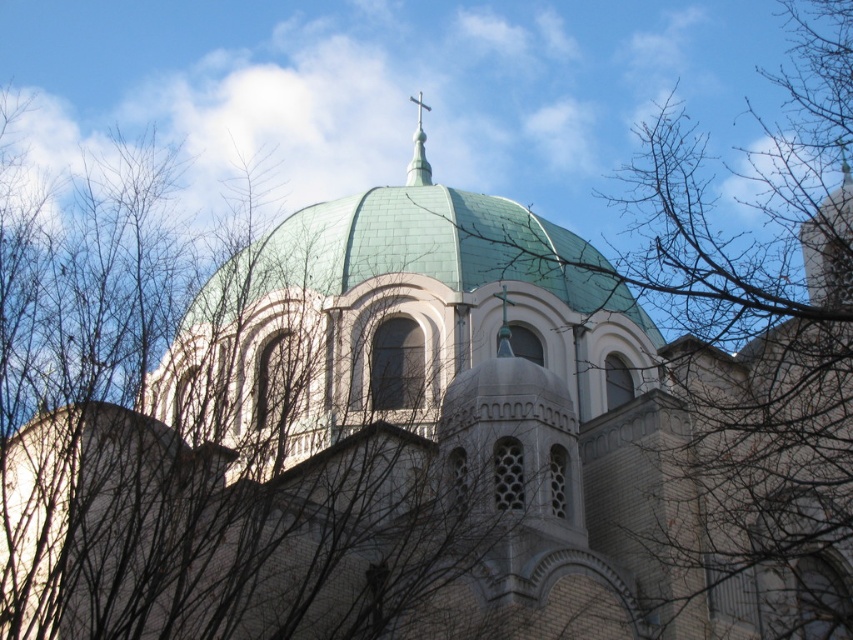
You are standing in front of the church building and notice two elements at the upper center of the image. Which one is positioned lower between the bare branches at upper center and the green metallic spire at upper center?

The bare branches at upper center is positioned lower than the green metallic spire at upper center.

You are standing in front of the church and looking up at the bare branches at upper center and the green tile dome at center. Which one is higher in the scene?

The bare branches at upper center is higher than the green tile dome at center in the scene.

You are an architect evaluating the church building. You need to determine which of the two green structures, the green tile dome at center or the green metallic spire at upper center, is taller. Based on the provided information, which one is taller?

The green metallic spire at upper center is taller than the green tile dome at center.